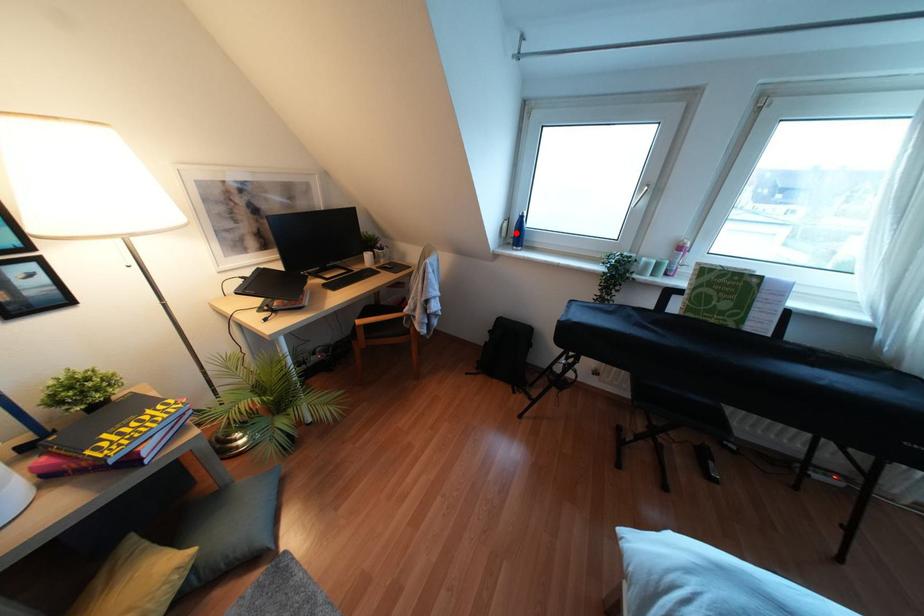
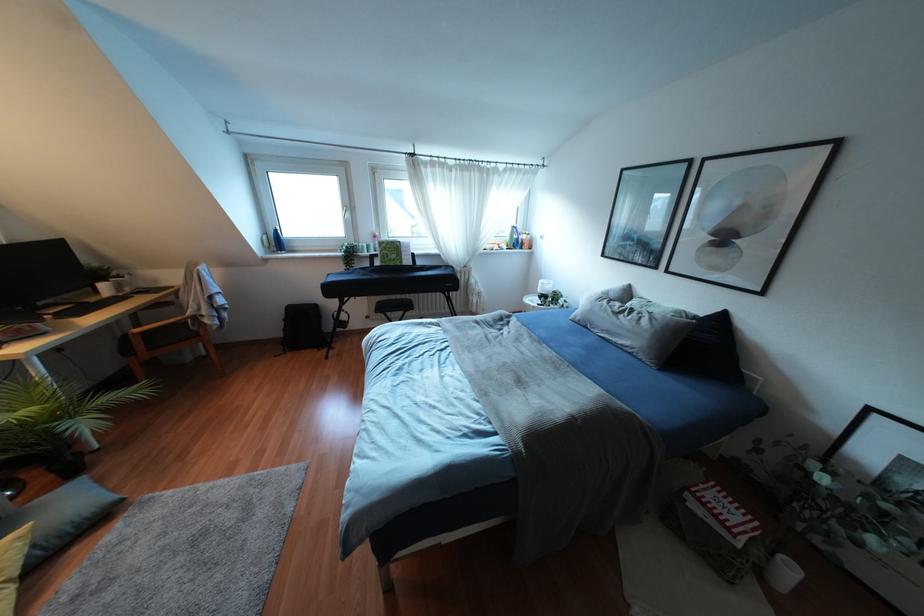
Question: I am providing you with two images of the same scene from different viewpoints. In image1, a red point is highlighted. Considering the same 3D point in image2, which of the following is correct?

Choices:
 (A) It is closer
 (B) It is farther

Answer: (B)